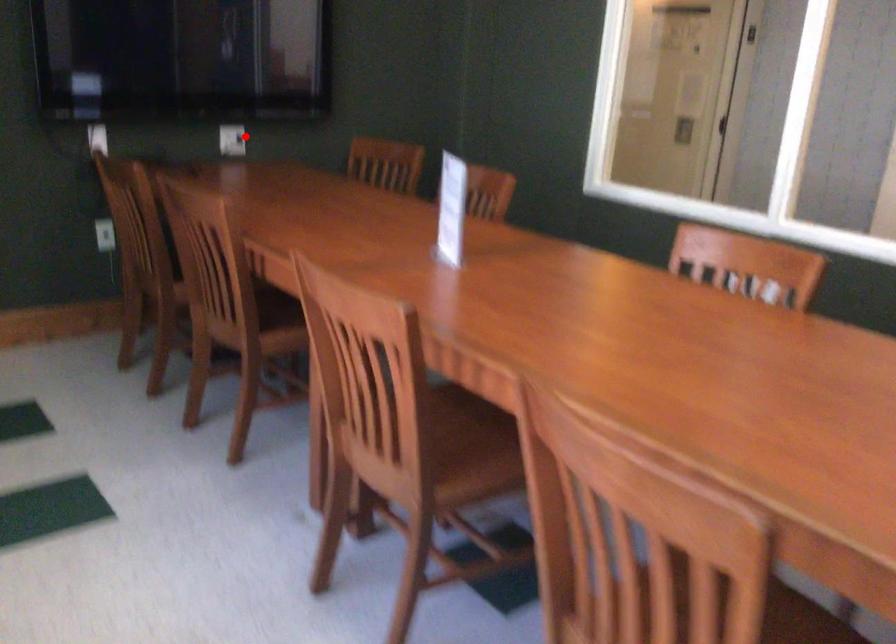
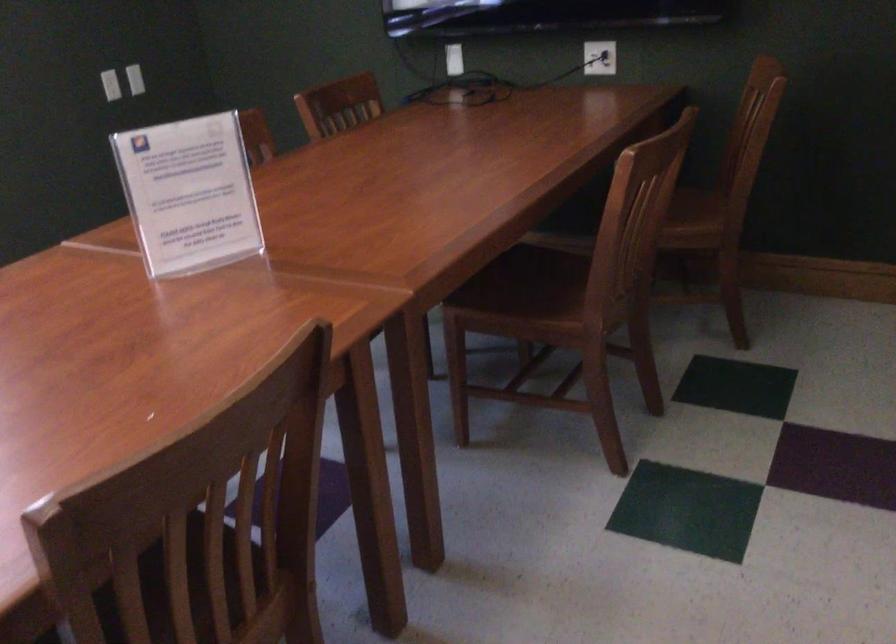
Question: I am providing you with two images of the same scene from different viewpoints. Given a red point in image1, look at the same physical point in image2. Is it:

Choices:
 (A) Closer to the viewpoint
 (B) Farther from the viewpoint

Answer: (A)